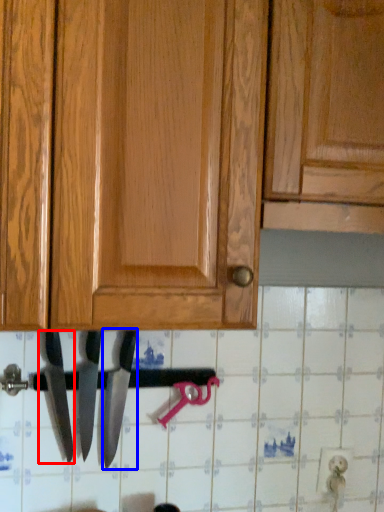
Question: Among these objects, which one is nearest to the camera, knife (highlighted by a red box) or knife (highlighted by a blue box)?

Choices:
 (A) knife
 (B) knife

Answer: (A)